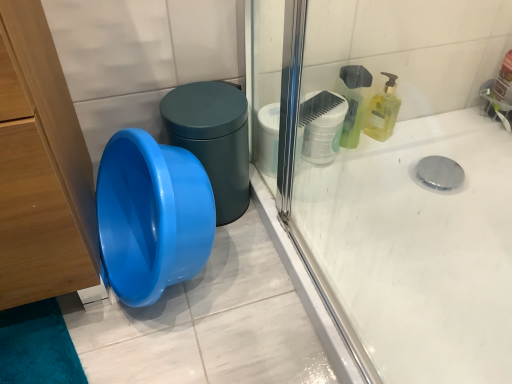
Question: From the image's perspective, is yellow translucent liquid soap at upper right above white matte toilet paper at upper right?

Choices:
 (A) yes
 (B) no

Answer: (A)

Question: Considering the relative sizes of yellow translucent liquid soap at upper right and white matte toilet paper at upper right in the image provided, is yellow translucent liquid soap at upper right wider than white matte toilet paper at upper right?

Choices:
 (A) no
 (B) yes

Answer: (A)

Question: Does yellow translucent liquid soap at upper right appear on the right side of white matte toilet paper at upper right?

Choices:
 (A) no
 (B) yes

Answer: (B)

Question: Is yellow translucent liquid soap at upper right outside white matte toilet paper at upper right?

Choices:
 (A) yes
 (B) no

Answer: (A)

Question: Does yellow translucent liquid soap at upper right have a lesser height compared to white matte toilet paper at upper right?

Choices:
 (A) yes
 (B) no

Answer: (B)

Question: Could you tell me if yellow translucent liquid soap at upper right is turned towards white matte toilet paper at upper right?

Choices:
 (A) yes
 (B) no

Answer: (B)

Question: From the image's perspective, would you say silver metallic faucet at upper right is shown under blue glossy potty at center left?

Choices:
 (A) yes
 (B) no

Answer: (B)

Question: Is silver metallic faucet at upper right placed right next to blue glossy potty at center left?

Choices:
 (A) no
 (B) yes

Answer: (A)

Question: Does silver metallic faucet at upper right lie behind blue glossy potty at center left?

Choices:
 (A) yes
 (B) no

Answer: (A)

Question: Is silver metallic faucet at upper right oriented towards blue glossy potty at center left?

Choices:
 (A) yes
 (B) no

Answer: (B)

Question: Can you confirm if silver metallic faucet at upper right is shorter than blue glossy potty at center left?

Choices:
 (A) no
 (B) yes

Answer: (B)

Question: Is silver metallic faucet at upper right far away from blue glossy potty at center left?

Choices:
 (A) yes
 (B) no

Answer: (B)

Question: Can you confirm if blue glossy potty at center left is thinner than white matte toilet paper at upper right?

Choices:
 (A) no
 (B) yes

Answer: (A)